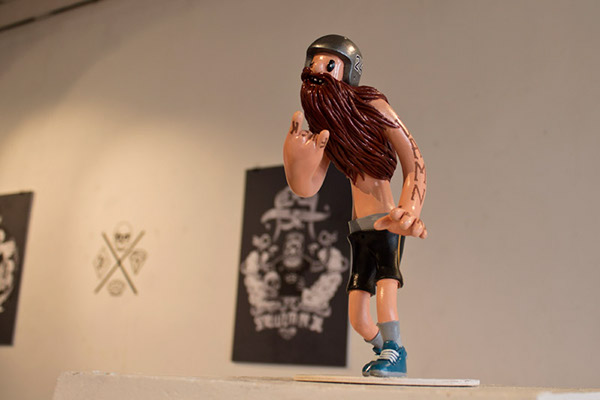
Locate an element on the screen. This screenshot has width=600, height=400. white wall is located at coordinates (173, 84).